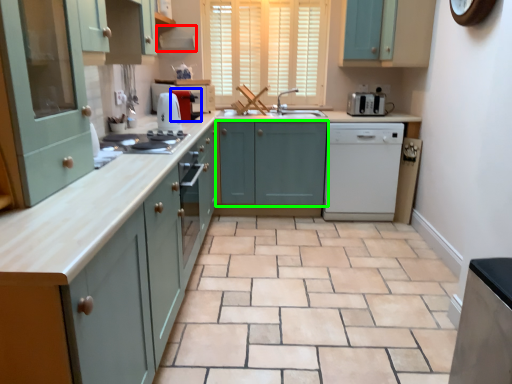
Question: Which is farther away from exhaust hood (highlighted by a red box)? coffee machine (highlighted by a blue box) or cabinetry (highlighted by a green box)?

Choices:
 (A) coffee machine
 (B) cabinetry

Answer: (B)